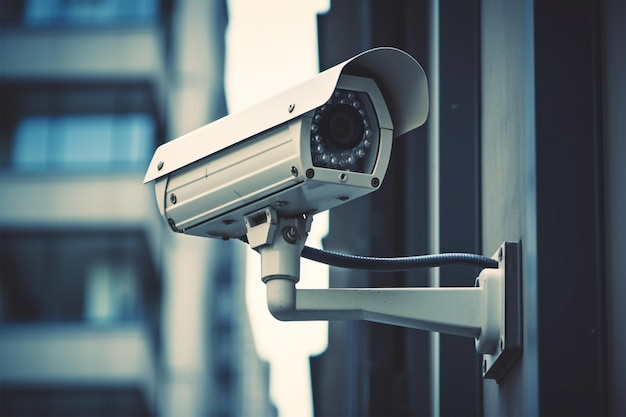
I want to click on plate, so click(x=499, y=291).